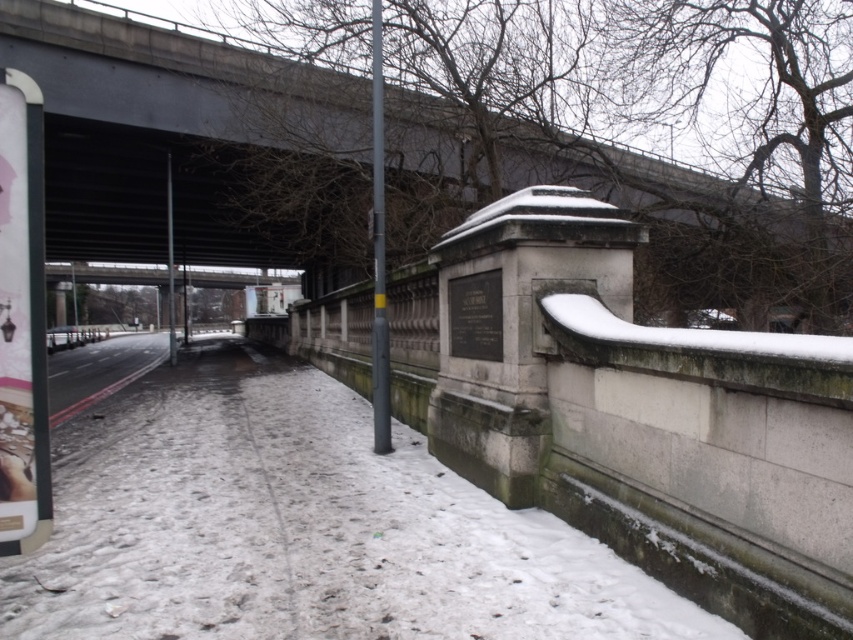
Question: Which point is closer to the camera?

Choices:
 (A) white matte snow at center
 (B) gray stone monument at center

Answer: (A)

Question: In this image, where is concrete bridge at upper center located relative to white matte snow at center?

Choices:
 (A) left
 (B) right

Answer: (A)

Question: Can you confirm if concrete bridge at upper center is positioned to the left of white matte snow at center?

Choices:
 (A) yes
 (B) no

Answer: (A)

Question: Which object is positioned farthest from the concrete bridge at upper center?

Choices:
 (A) gray stone monument at center
 (B) white matte snow at center

Answer: (A)

Question: Among these objects, which one is nearest to the camera?

Choices:
 (A) white matte snow at center
 (B) concrete bridge at upper center
 (C) gray stone monument at center

Answer: (A)

Question: Considering the relative positions of concrete bridge at upper center and white matte snow at center in the image provided, where is concrete bridge at upper center located with respect to white matte snow at center?

Choices:
 (A) below
 (B) above

Answer: (B)